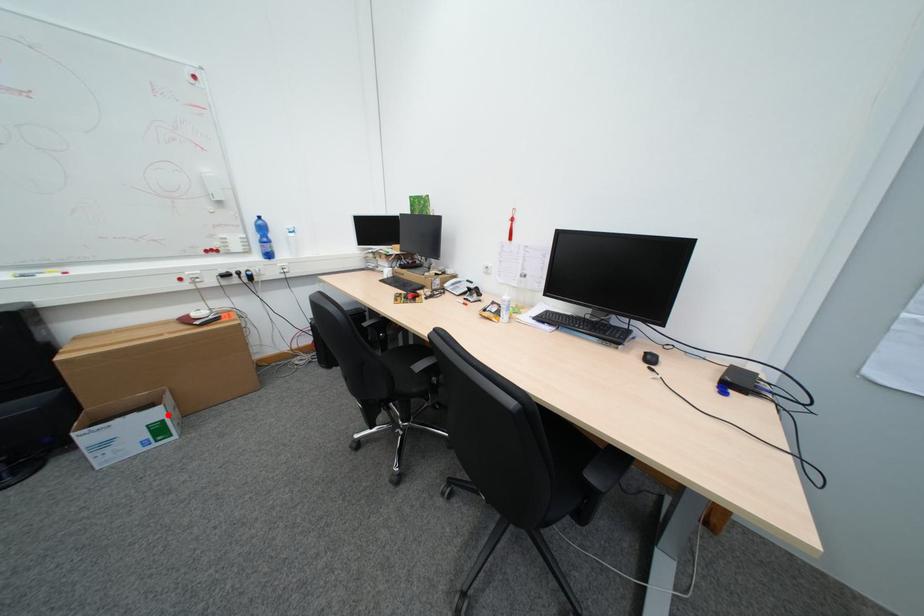
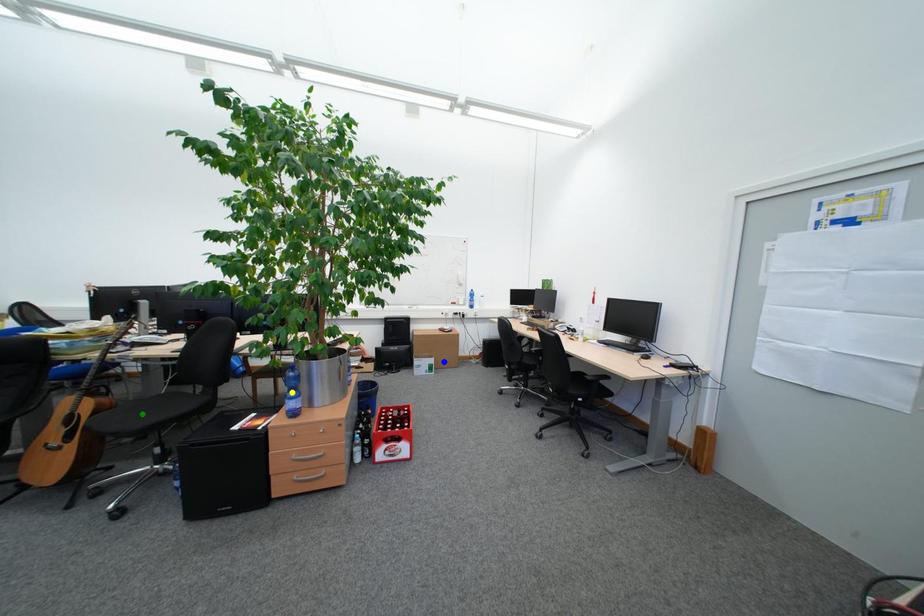
Question: I am providing you with two images of the same scene from different viewpoints. A red point is marked on the first image. You are given multiple points on the second image. Can you choose the point in image 2 that corresponds to the point in image 1?

Choices:
 (A) green point
 (B) yellow point
 (C) blue point

Answer: (C)